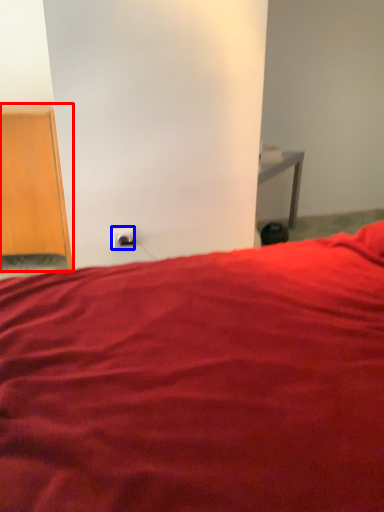
Question: Which point is closer to the camera, furniture (highlighted by a red box) or electric outlet (highlighted by a blue box)?

Choices:
 (A) furniture
 (B) electric outlet

Answer: (A)